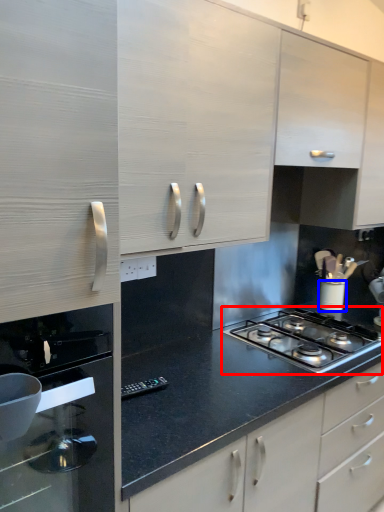
Question: Which point is further to the camera, gas stove (highlighted by a red box) or kitchen appliance (highlighted by a blue box)?

Choices:
 (A) gas stove
 (B) kitchen appliance

Answer: (B)